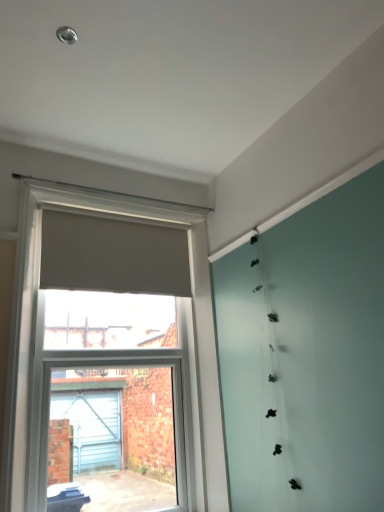
Question: Could you tell me if matte gray roller blind at left is facing matte beige curtain at upper center?

Choices:
 (A) yes
 (B) no

Answer: (A)

Question: Is matte gray roller blind at left shorter than matte beige curtain at upper center?

Choices:
 (A) yes
 (B) no

Answer: (B)

Question: From a real-world perspective, is matte gray roller blind at left physically below matte beige curtain at upper center?

Choices:
 (A) no
 (B) yes

Answer: (B)

Question: Considering the relative positions of matte gray roller blind at left and matte beige curtain at upper center in the image provided, is matte gray roller blind at left in front of matte beige curtain at upper center?

Choices:
 (A) yes
 (B) no

Answer: (A)

Question: Considering the relative sizes of matte gray roller blind at left and matte beige curtain at upper center in the image provided, is matte gray roller blind at left wider than matte beige curtain at upper center?

Choices:
 (A) no
 (B) yes

Answer: (B)

Question: From a real-world perspective, is matte gray roller blind at left on matte beige curtain at upper center?

Choices:
 (A) no
 (B) yes

Answer: (A)

Question: Can you confirm if matte beige curtain at upper center is smaller than matte gray roller blind at left?

Choices:
 (A) no
 (B) yes

Answer: (B)

Question: Is matte beige curtain at upper center at the right side of matte gray roller blind at left?

Choices:
 (A) yes
 (B) no

Answer: (B)

Question: Is matte beige curtain at upper center placed right next to matte gray roller blind at left?

Choices:
 (A) no
 (B) yes

Answer: (A)

Question: Would you consider matte beige curtain at upper center to be distant from matte gray roller blind at left?

Choices:
 (A) yes
 (B) no

Answer: (B)

Question: Can you confirm if matte beige curtain at upper center is wider than matte gray roller blind at left?

Choices:
 (A) no
 (B) yes

Answer: (A)

Question: From the image's perspective, is matte beige curtain at upper center on matte gray roller blind at left?

Choices:
 (A) no
 (B) yes

Answer: (B)

Question: Considering the positions of matte gray roller blind at left and matte beige curtain at upper center in the image, is matte gray roller blind at left wider or thinner than matte beige curtain at upper center?

Choices:
 (A) thin
 (B) wide

Answer: (B)